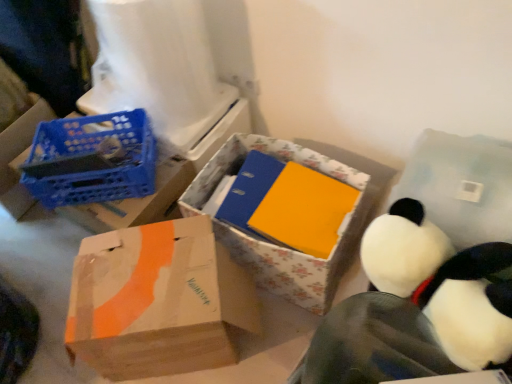
What do you see at coordinates (461, 186) in the screenshot?
I see `white plush toy at upper right` at bounding box center [461, 186].

Locate an element on the screen. Image resolution: width=512 pixels, height=384 pixels. white plush toy at upper right is located at coordinates (461, 186).

Describe the element at coordinates (92, 159) in the screenshot. I see `blue plastic crate at left` at that location.

You are a GUI agent. You are given a task and a screenshot of the screen. Output one action in this format:
    pyautogui.click(x=<x>, y=<y>)
    Task: Click on the blue plastic crate at left, the third box when ordered from right to left
    The width and height of the screenshot is (512, 384).
    Given the screenshot: What is the action you would take?
    pyautogui.click(x=18, y=156)

This screenshot has height=384, width=512. What do you see at coordinates (18, 156) in the screenshot?
I see `blue plastic crate at left, the 1th box in the left-to-right sequence` at bounding box center [18, 156].

Locate an element on the screen. The image size is (512, 384). white plush toy at upper right is located at coordinates (461, 186).

Considering the positions of points (24, 127) and (322, 147), is point (24, 127) farther from camera compared to point (322, 147)?

No.

Is blue plastic crate at left, the third box when ordered from right to left, positioned with its back to floral cardboard box at center, which is the first box in right-to-left order?

That's not correct — blue plastic crate at left, the third box when ordered from right to left, is not looking away from floral cardboard box at center, which is the first box in right-to-left order.

Considering the relative sizes of blue plastic crate at left, the 1th box in the left-to-right sequence, and floral cardboard box at center, which is the third box from left to right, in the image provided, is blue plastic crate at left, the 1th box in the left-to-right sequence, thinner than floral cardboard box at center, which is the third box from left to right,?

No.

From the image's perspective, does blue plastic crate at left, the 1th box in the left-to-right sequence, appear lower than white plastic toilet paper at upper left?

Yes, from the image's perspective, blue plastic crate at left, the 1th box in the left-to-right sequence, is beneath white plastic toilet paper at upper left.

Considering the sizes of blue plastic crate at left, the 1th box in the left-to-right sequence, and white plastic toilet paper at upper left in the image, is blue plastic crate at left, the 1th box in the left-to-right sequence, taller or shorter than white plastic toilet paper at upper left?

In the image, blue plastic crate at left, the 1th box in the left-to-right sequence, appears to be shorter than white plastic toilet paper at upper left.

Who is smaller, blue plastic crate at left, the 1th box in the left-to-right sequence, or white plastic toilet paper at upper left?

Smaller between the two is white plastic toilet paper at upper left.

Starting from the white plastic toilet paper at upper left, which box is the 2nd one in front? Please provide its 2D coordinates.

[(158, 301)]

Is brown cardboard box at lower left, positioned as the second box in left-to-right order, with white plastic toilet paper at upper left?

No, brown cardboard box at lower left, positioned as the second box in left-to-right order, is not with white plastic toilet paper at upper left.

Considering the sizes of brown cardboard box at lower left, arranged as the second box when viewed from the right, and white plastic toilet paper at upper left in the image, is brown cardboard box at lower left, arranged as the second box when viewed from the right, taller or shorter than white plastic toilet paper at upper left?

Considering their sizes, brown cardboard box at lower left, arranged as the second box when viewed from the right, has less height than white plastic toilet paper at upper left.

Considering the sizes of floral cardboard box at center, which is the third box from left to right, and white plastic toilet paper at upper left in the image, is floral cardboard box at center, which is the third box from left to right, bigger or smaller than white plastic toilet paper at upper left?

Considering their sizes, floral cardboard box at center, which is the third box from left to right, takes up less space than white plastic toilet paper at upper left.

Is floral cardboard box at center, which is the first box in right-to-left order, far from white plastic toilet paper at upper left?

floral cardboard box at center, which is the first box in right-to-left order, is near white plastic toilet paper at upper left, not far away.

Which point is more distant from viewer, (203,201) or (173,105)?

The point (203,201) is more distant.

Can you confirm if floral cardboard box at center, which is the third box from left to right, is positioned to the left of white plastic toilet paper at upper left?

No.

Considering the relative sizes of white plastic toilet paper at upper left and floral cardboard box at center, which is the first box in right-to-left order, in the image provided, is white plastic toilet paper at upper left taller than floral cardboard box at center, which is the first box in right-to-left order,?

Yes.

Could floral cardboard box at center, which is the third box from left to right, be considered to be inside white plastic toilet paper at upper left?

Actually, floral cardboard box at center, which is the third box from left to right, is outside white plastic toilet paper at upper left.

In the image, is white plastic toilet paper at upper left positioned in front of or behind floral cardboard box at center, which is the first box in right-to-left order?

In the image, white plastic toilet paper at upper left appears behind floral cardboard box at center, which is the first box in right-to-left order.

Measure the distance between white plastic toilet paper at upper left and floral cardboard box at center, which is the first box in right-to-left order.

They are 17.39 inches apart.

Which is correct: blue plastic crate at left, the 1th box in the left-to-right sequence, is inside blue plastic crate at left, or outside of it?

blue plastic crate at left, the 1th box in the left-to-right sequence, is located beyond the bounds of blue plastic crate at left.

How much distance is there between blue plastic crate at left, the 1th box in the left-to-right sequence, and blue plastic crate at left?

They are 15.81 inches apart.

Which is in front, blue plastic crate at left, the 1th box in the left-to-right sequence, or blue plastic crate at left?

blue plastic crate at left is more forward.

Can you see blue plastic crate at left, the third box when ordered from right to left, touching blue plastic crate at left?

No, blue plastic crate at left, the third box when ordered from right to left, is not next to blue plastic crate at left.

Can you tell me how much white plastic toilet paper at upper left and white plush toy at upper right differ in facing direction?

They differ by 5.27 degrees in their facing directions.

Can you confirm if white plastic toilet paper at upper left is shorter than white plush toy at upper right?

No, white plastic toilet paper at upper left is not shorter than white plush toy at upper right.

Consider the image. Are white plastic toilet paper at upper left and white plush toy at upper right far apart?

That's not correct — white plastic toilet paper at upper left is a little close to white plush toy at upper right.

Does point (157, 56) lie in front of point (425, 208)?

No, it is not.

This screenshot has height=384, width=512. Identify the location of box that appears above the floral cardboard box at center, which is the third box from left to right (from the image's perspective). (18, 156).

I want to click on toilet paper on the right of blue plastic crate at left, the 1th box in the left-to-right sequence, so (x=153, y=61).

From the image, which object appears to be nearer to floral cardboard box at center, which is the first box in right-to-left order, brown cardboard box at lower left, arranged as the second box when viewed from the right, or white plush toy at upper right?

brown cardboard box at lower left, arranged as the second box when viewed from the right, lies closer to floral cardboard box at center, which is the first box in right-to-left order, than the other object.

Estimate the real-world distances between objects in this image. Which object is closer to blue plastic crate at left, the 1th box in the left-to-right sequence, white plush toy at upper right or white plastic toilet paper at upper left?

Among the two, white plastic toilet paper at upper left is located nearer to blue plastic crate at left, the 1th box in the left-to-right sequence.

Looking at this image, estimate the real-world distances between objects in this image. Which object is further from brown cardboard box at lower left, positioned as the second box in left-to-right order, blue plastic crate at left or floral cardboard box at center, which is the third box from left to right?

Based on the image, blue plastic crate at left appears to be further to brown cardboard box at lower left, positioned as the second box in left-to-right order.

Which object lies nearer to the anchor point white plush toy at upper right, blue plastic crate at left or white plush penguin at lower right?

white plush penguin at lower right.

Based on their spatial positions, is white plush penguin at lower right or blue plastic crate at left, the third box when ordered from right to left, closer to blue plastic crate at left?

The object closer to blue plastic crate at left is blue plastic crate at left, the third box when ordered from right to left.

Estimate the real-world distances between objects in this image. Which object is further from brown cardboard box at lower left, positioned as the second box in left-to-right order, floral cardboard box at center, which is the first box in right-to-left order, or white plush toy at upper right?

white plush toy at upper right.

When comparing their distances from white plush penguin at lower right, does floral cardboard box at center, which is the first box in right-to-left order, or brown cardboard box at lower left, positioned as the second box in left-to-right order, seem closer?

floral cardboard box at center, which is the first box in right-to-left order, lies closer to white plush penguin at lower right than the other object.

Looking at the image, which one is located closer to floral cardboard box at center, which is the third box from left to right, white plush penguin at lower right or white plush toy at upper right?

Based on the image, white plush penguin at lower right appears to be nearer to floral cardboard box at center, which is the third box from left to right.

You are a GUI agent. You are given a task and a screenshot of the screen. Output one action in this format:
    pyautogui.click(x=<x>, y=<y>)
    Task: Click on the toilet paper located between blue plastic crate at left, the third box when ordered from right to left, and white plush toy at upper right in the left-right direction
    This screenshot has height=384, width=512.
    Given the screenshot: What is the action you would take?
    pyautogui.click(x=153, y=61)

Find the location of a particular element. basket between white plastic toilet paper at upper left and white plush penguin at lower right in the vertical direction is located at coordinates (92, 159).

Find the location of a particular element. The image size is (512, 384). basket between blue plastic crate at left, the 1th box in the left-to-right sequence, and white plastic toilet paper at upper left is located at coordinates (92, 159).

The height and width of the screenshot is (384, 512). In order to click on box between brown cardboard box at lower left, arranged as the second box when viewed from the right, and white plush toy at upper right from left to right in this screenshot , I will do `click(277, 245)`.